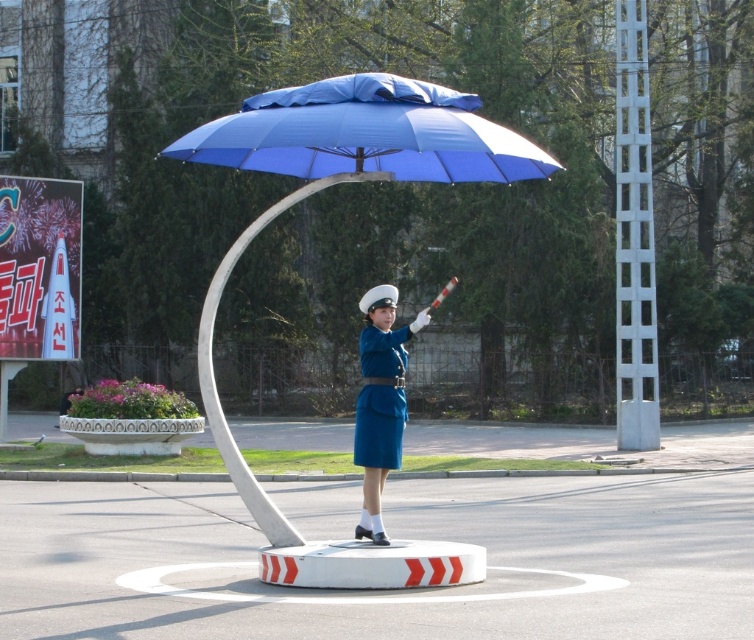
Question: In this image, where is white lattice pole at right located relative to blue matte uniform at center?

Choices:
 (A) above
 (B) below

Answer: (A)

Question: Which point is closer to the camera taking this photo?

Choices:
 (A) (388, 356)
 (B) (630, 314)
 (C) (362, 353)

Answer: (A)

Question: Is blue matte umbrella at center below white lattice pole at right?

Choices:
 (A) no
 (B) yes

Answer: (B)

Question: Which of the following is the farthest from the observer?

Choices:
 (A) (366, 376)
 (B) (366, 486)
 (C) (188, 160)

Answer: (B)

Question: Which of these objects is positioned closest to the blue matte umbrella at center?

Choices:
 (A) blue matte uniform at center
 (B) blue fabric uniform at center

Answer: (B)

Question: Can you confirm if blue matte umbrella at center is positioned to the right of blue matte uniform at center?

Choices:
 (A) yes
 (B) no

Answer: (B)